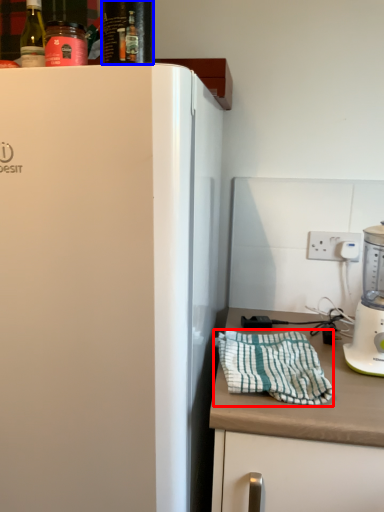
Question: Which object is closer to the camera taking this photo, blanket (highlighted by a red box) or beverage (highlighted by a blue box)?

Choices:
 (A) blanket
 (B) beverage

Answer: (B)